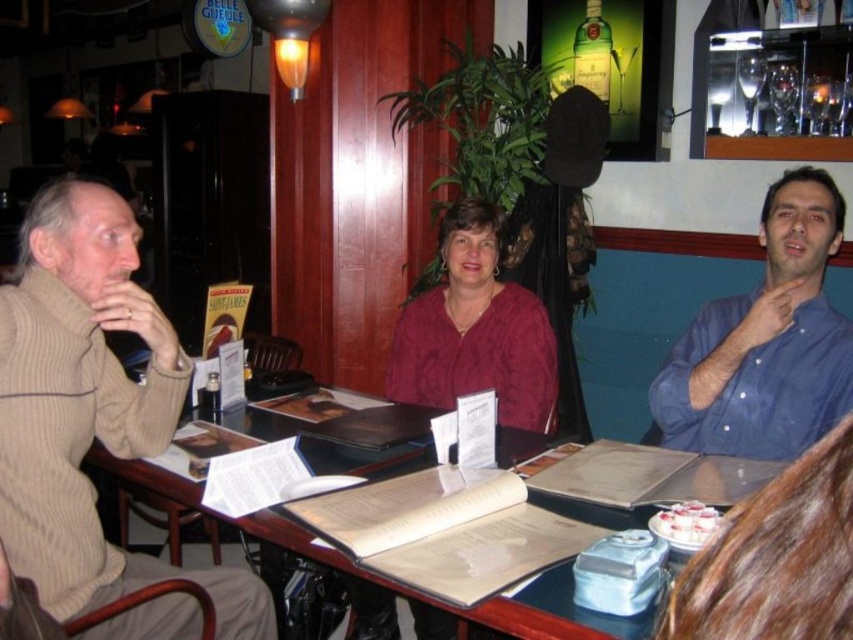
Between maroon sweater at center and knitted maroon sweater at center, which one appears on the right side from the viewer's perspective?

maroon sweater at center

Describe the element at coordinates (474, 330) in the screenshot. The height and width of the screenshot is (640, 853). I see `maroon sweater at center` at that location.

This screenshot has height=640, width=853. In order to click on maroon sweater at center in this screenshot , I will do `click(474, 330)`.

Is beige ribbed sweater at left behind blue button-down shirt at right?

No, beige ribbed sweater at left is in front of blue button-down shirt at right.

Does beige ribbed sweater at left have a larger size compared to blue button-down shirt at right?

Yes.

Which is in front, point (136, 244) or point (802, 211)?

Point (802, 211)

The image size is (853, 640). In order to click on beige ribbed sweater at left in this screenshot , I will do `click(90, 408)`.

Who is taller, beige ribbed sweater at left or maroon sweater at center?

Standing taller between the two is beige ribbed sweater at left.

You are a GUI agent. You are given a task and a screenshot of the screen. Output one action in this format:
    pyautogui.click(x=<x>, y=<y>)
    Task: Click on the beige ribbed sweater at left
    The image size is (853, 640).
    Given the screenshot: What is the action you would take?
    pyautogui.click(x=90, y=408)

The image size is (853, 640). In order to click on beige ribbed sweater at left in this screenshot , I will do `click(90, 408)`.